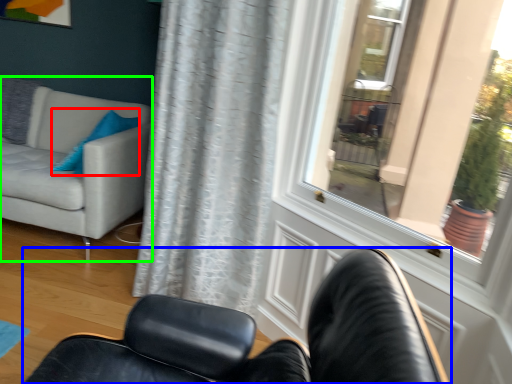
Question: Which object is positioned farthest from pillow (highlighted by a red box)? Select from chair (highlighted by a blue box) and studio couch (highlighted by a green box).

Choices:
 (A) chair
 (B) studio couch

Answer: (A)